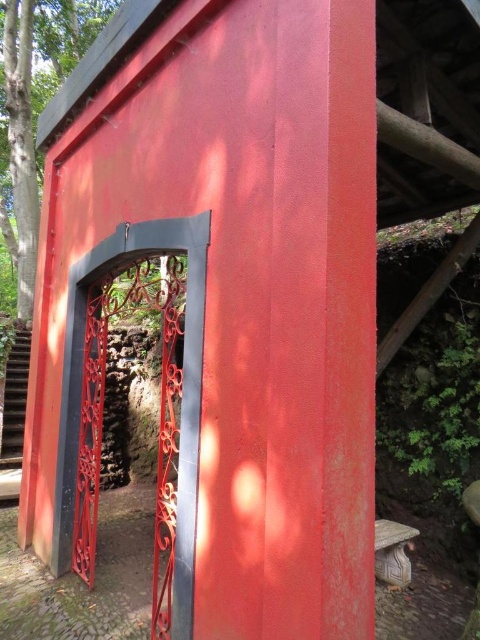
You are a painter who needs to decide which object to paint first. The wrought iron gate at center and the carved stone stool at lower right are both in your view. Based on their sizes, which object should you tackle first if you want to start with the bigger one?

The wrought iron gate at center is larger in size than the carved stone stool at lower right, so you should paint the wrought iron gate at center first.

You are an architect designing a garden layout. You need to place a new bench that must be narrower than the green leafy tree at upper left. Can the carved stone stool at lower right fit in this space?

The carved stone stool at lower right can fit because the green leafy tree at upper left might be wider than the carved stone stool at lower right, so the stool is narrower and would fit in the space.